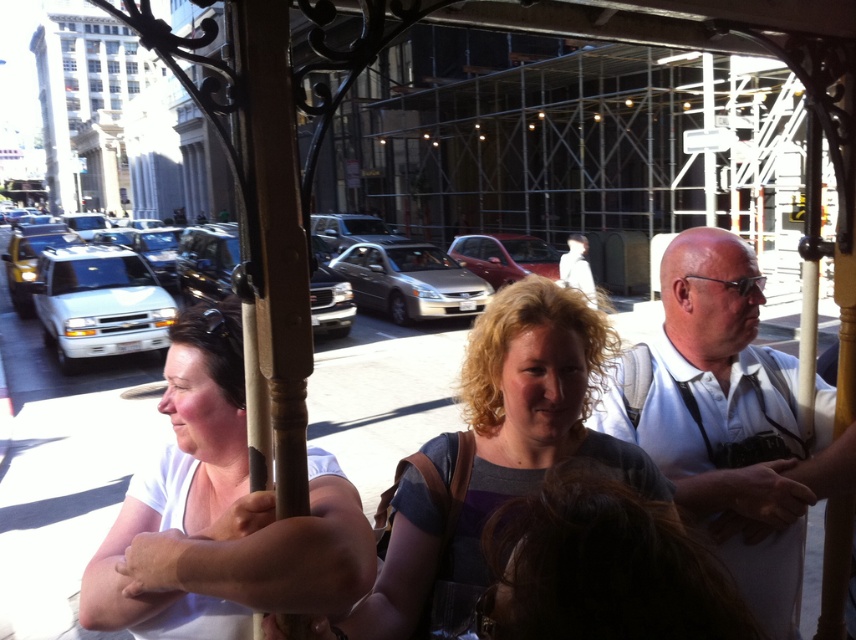
Question: Observing the image, what is the correct spatial positioning of white shirt at center in reference to matte gray shirt at center?

Choices:
 (A) right
 (B) left

Answer: (A)

Question: Which object appears farthest from the camera in this image?

Choices:
 (A) white matte shirt at center
 (B) matte gray shirt at center

Answer: (B)

Question: Is white shirt at center smaller than matte gray shirt at center?

Choices:
 (A) yes
 (B) no

Answer: (B)

Question: Is white matte shirt at center behind white shirt at center?

Choices:
 (A) yes
 (B) no

Answer: (B)

Question: Which point is farther to the camera?

Choices:
 (A) white matte shirt at center
 (B) white shirt at center

Answer: (B)

Question: Which object is the closest to the white shirt at center?

Choices:
 (A) matte gray shirt at center
 (B) white matte shirt at center

Answer: (A)